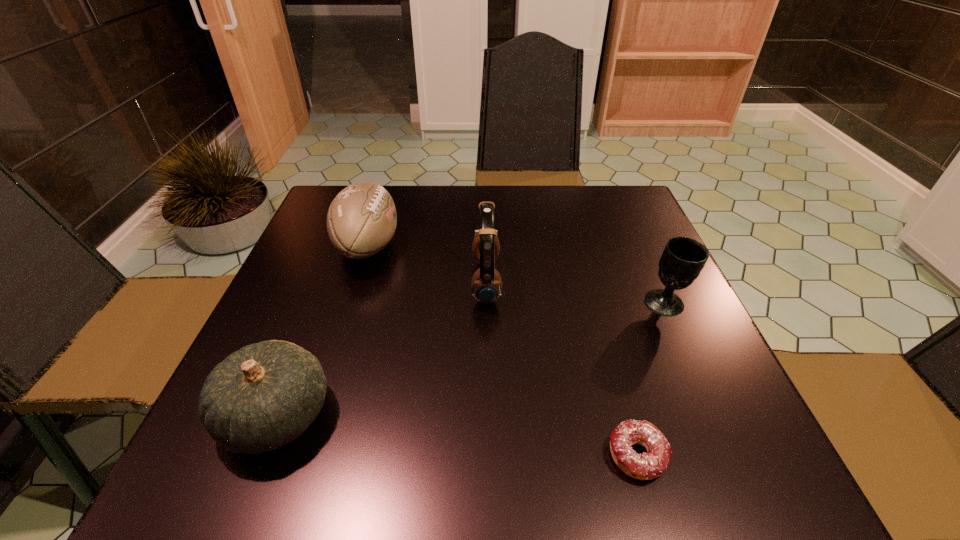
Locate an element on the screen. This screenshot has height=540, width=960. doughnut that is at the right edge is located at coordinates (645, 466).

Locate an element on the screen. The image size is (960, 540). object located at the far left corner is located at coordinates (361, 220).

Locate an element on the screen. Image resolution: width=960 pixels, height=540 pixels. object located in the near left corner section of the desktop is located at coordinates (265, 395).

Locate an element on the screen. Image resolution: width=960 pixels, height=540 pixels. object that is at the near right corner is located at coordinates click(x=645, y=466).

You are a GUI agent. You are given a task and a screenshot of the screen. Output one action in this format:
    pyautogui.click(x=<x>, y=<y>)
    Task: Click on the vacant space at the far edge of the desktop
    Image resolution: width=960 pixels, height=540 pixels.
    Given the screenshot: What is the action you would take?
    pyautogui.click(x=500, y=231)

In the image, there is a desktop. Identify the location of free space at the near edge. The width and height of the screenshot is (960, 540). (645, 453).

This screenshot has width=960, height=540. I want to click on free location at the left edge of the desktop, so click(x=345, y=261).

This screenshot has height=540, width=960. In the image, there is a desktop. Identify the location of free space at the right edge. (651, 239).

In the image, there is a desktop. Find the location of `vacant space at the far left corner`. vacant space at the far left corner is located at coordinates (306, 233).

At what (x,y) coordinates should I click in order to perform the action: click on free space at the far right corner of the desktop. Please return your answer as a coordinate pair (x, y). This screenshot has width=960, height=540. Looking at the image, I should click on (613, 205).